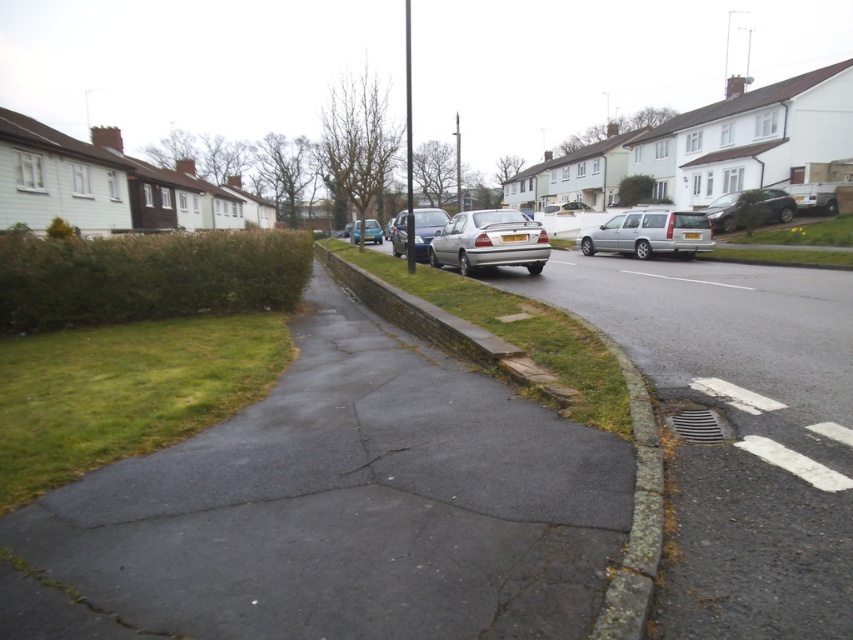
You are standing at the point marked by the coordinates in the image, which is labeled as point (x=517, y=332). What can you see directly in front of you?

At point (x=517, y=332), you can see green grass at center directly in front of you.